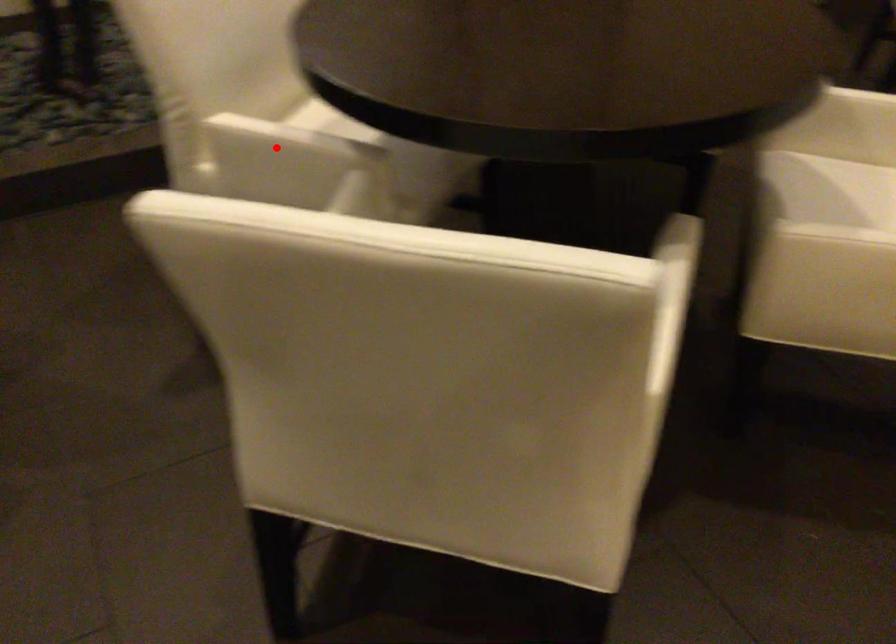
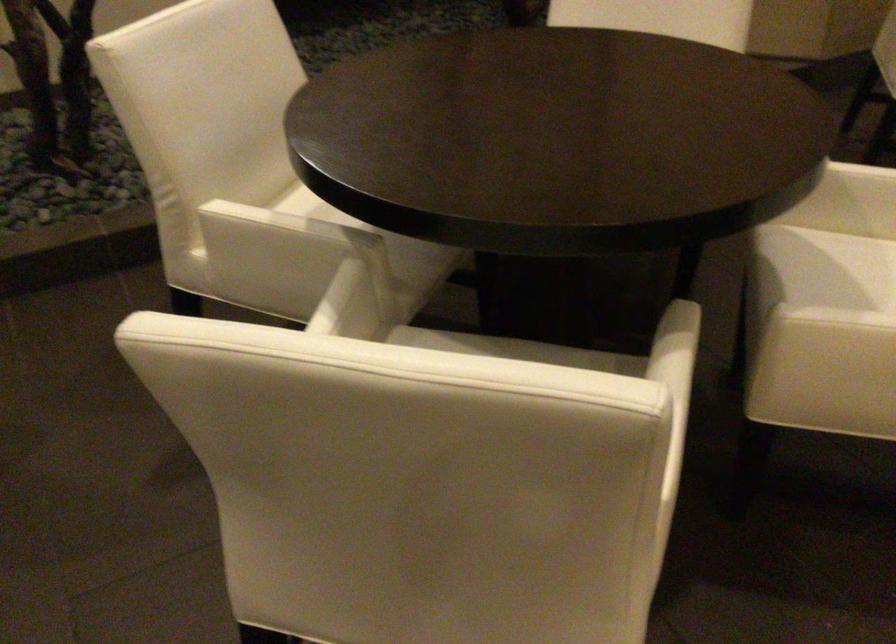
Where in the second image is the point corresponding to the highlighted location from the first image?

(270, 236)